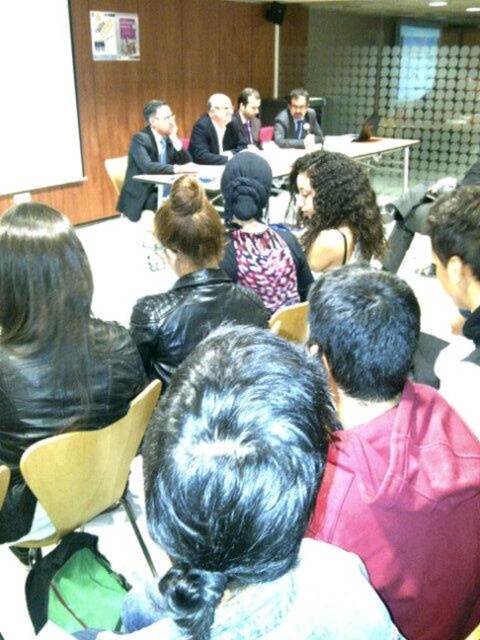
Question: Can you confirm if black leather jacket at center is positioned to the left of leather jacket at center?

Choices:
 (A) yes
 (B) no

Answer: (B)

Question: Does maroon hoodie at center appear over leather jacket at center?

Choices:
 (A) no
 (B) yes

Answer: (A)

Question: Which of the following is the closest to the observer?

Choices:
 (A) (342, 179)
 (B) (254, 378)
 (C) (474, 600)

Answer: (B)

Question: Which point is closer to the camera taking this photo?

Choices:
 (A) (194, 150)
 (B) (148, 164)
 (C) (181, 417)

Answer: (C)

Question: Estimate the real-world distances between objects in this image. Which object is closer to the black leather jacket at center?

Choices:
 (A) matte black suit at upper left
 (B) curly hair at center
 (C) maroon hoodie at center

Answer: (C)

Question: Can you confirm if curly hair at center is positioned below matte black suit at upper left?

Choices:
 (A) yes
 (B) no

Answer: (A)